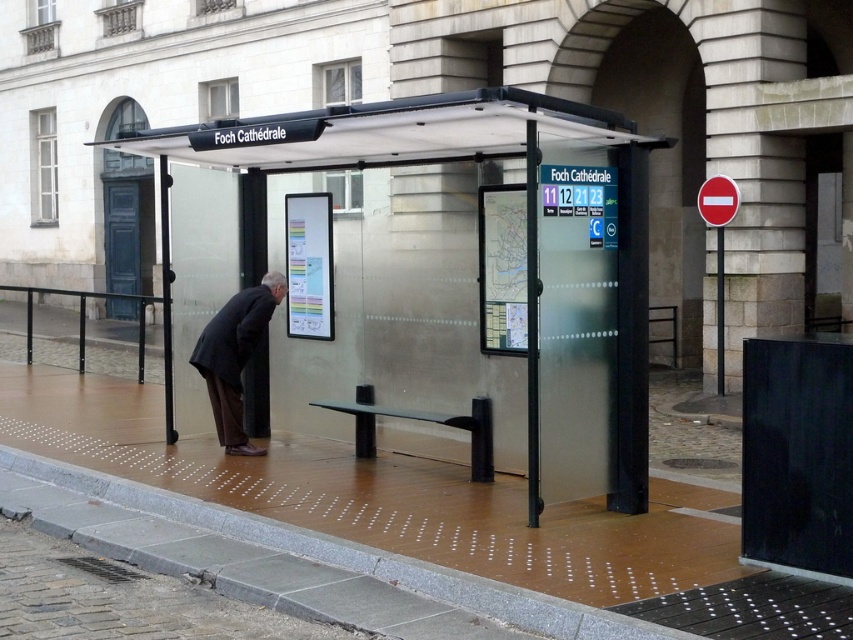
You are standing at the bus stop at Foch Cathedrale and want to find the nearest point to catch the next bus. The two points you are considering are point (248, 161) and point (236, 433). According to the spatial arrangement, which point is closer to you?

Point (236, 433) is closer to you because it is in front of point (248, 161).

You are standing at the Foch Cathedrale bus stop and want to check the bus schedule. You see a transparent glass bus stop at center and a dark gray suit at center. Which object should you approach to find the bus schedule information?

You should approach the transparent glass bus stop at center to find the bus schedule information because the map and display board showing bus routes and schedules are located on the right side of the shelter, which aligns with the transparent glass bus stop at center being to the right of the dark gray suit at center.

In the scene shown: You are a delivery person carrying a package that is 3.5 meters long. You need to place it between the transparent glass bus stop at center and the dark gray suit at center. Is there enough space to fit the package between them?

The distance between the transparent glass bus stop at center and the dark gray suit at center is 3.47 meters. Since the package is 3.5 meters long, it will not fit between them as the space is slightly shorter than the package.